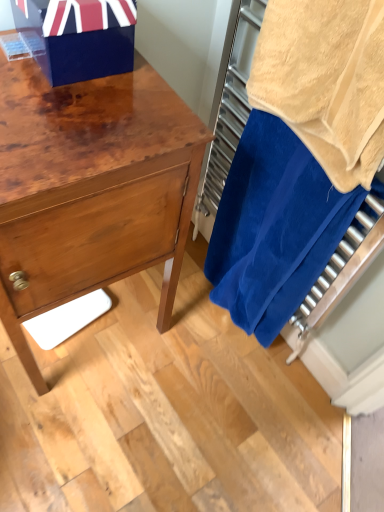
This screenshot has height=512, width=384. I want to click on free location to the right of shiny wood chest of drawers at left, so click(198, 369).